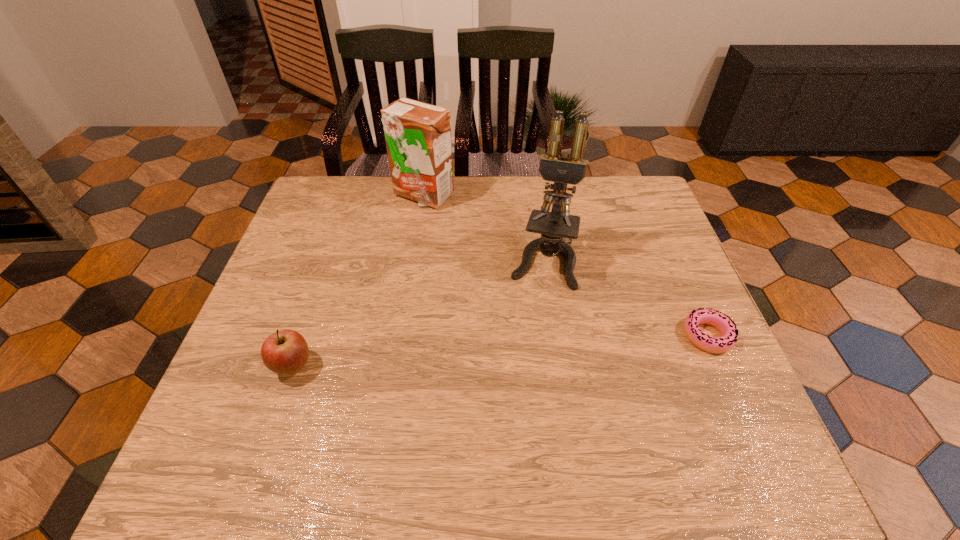
Identify the location of free spot on the desktop that is between the second shortest object and the doughnut and is positioned at the eyepieces of the third nearest object. This screenshot has height=540, width=960. click(523, 349).

Where is `free space on the desktop that is between the leftmost object and the doughnut and is positioned on the straw side of the farthest object`? free space on the desktop that is between the leftmost object and the doughnut and is positioned on the straw side of the farthest object is located at coordinates (458, 354).